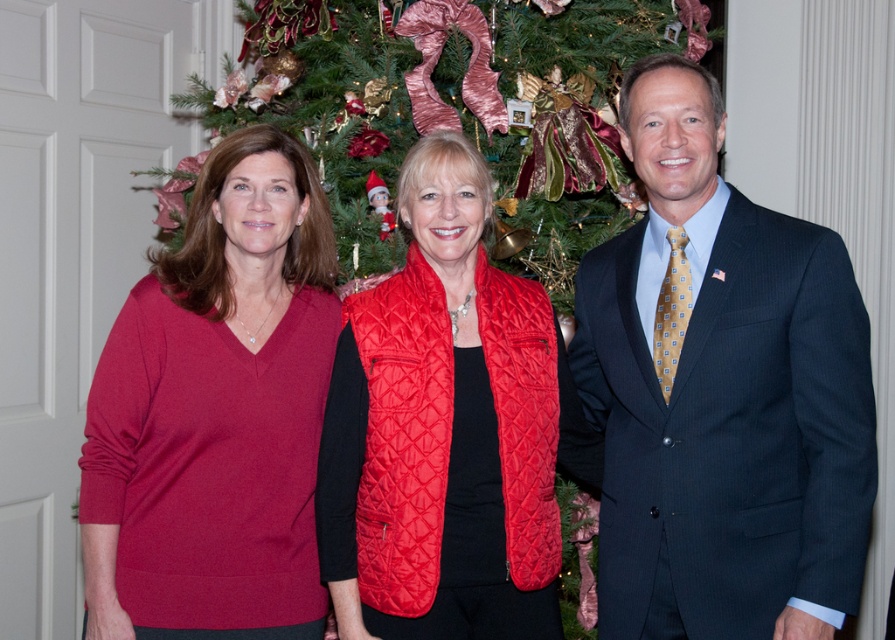
Question: Which of these objects is positioned closest to the dark blue suit at center?

Choices:
 (A) green textured christmas tree at center
 (B) quilted red vest at center

Answer: (B)

Question: Does matte red sweater at left lie in front of green textured christmas tree at center?

Choices:
 (A) no
 (B) yes

Answer: (B)

Question: Which of the following is the farthest from the observer?

Choices:
 (A) (177, 557)
 (B) (490, 84)
 (C) (339, 368)

Answer: (B)

Question: Can you confirm if dark blue suit at center is smaller than matte red sweater at left?

Choices:
 (A) yes
 (B) no

Answer: (B)

Question: Where is dark blue suit at center located in relation to quilted red vest at center in the image?

Choices:
 (A) below
 (B) above

Answer: (B)

Question: Which of these objects is positioned closest to the matte red sweater at left?

Choices:
 (A) green textured christmas tree at center
 (B) quilted red vest at center

Answer: (B)